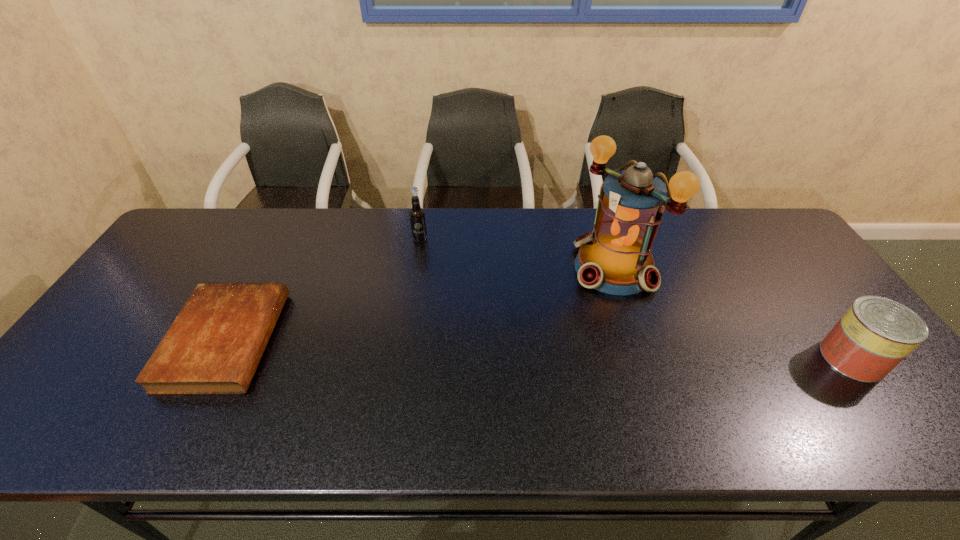
Find the location of a particular element. This screenshot has width=960, height=540. empty space that is in between the leftmost object and the tallest object is located at coordinates (420, 304).

The height and width of the screenshot is (540, 960). I want to click on unoccupied position between the tallest object and the can, so click(x=732, y=313).

What are the coordinates of `vacant area that lies between the root beer and the shortest object` in the screenshot? It's located at (323, 289).

Where is `free space between the leftmost object and the lantern`? free space between the leftmost object and the lantern is located at coordinates (420, 304).

Locate an element on the screen. The image size is (960, 540). vacant area that lies between the Bible and the third tallest object is located at coordinates (540, 349).

The image size is (960, 540). What are the coordinates of `free point between the rightmost object and the shortest object` in the screenshot? It's located at (540, 349).

The height and width of the screenshot is (540, 960). In order to click on vacant space that's between the leftmost object and the rightmost object in this screenshot , I will do `click(540, 349)`.

Identify which object is the nearest to the shortest object. Please provide its 2D coordinates. Your answer should be formatted as a tuple, i.e. [(x, y)], where the tuple contains the x and y coordinates of a point satisfying the conditions above.

[(417, 216)]

Choose which object is the third nearest neighbor to the tallest object. Please provide its 2D coordinates. Your answer should be formatted as a tuple, i.e. [(x, y)], where the tuple contains the x and y coordinates of a point satisfying the conditions above.

[(213, 347)]

You are a GUI agent. You are given a task and a screenshot of the screen. Output one action in this format:
    pyautogui.click(x=<x>, y=<y>)
    Task: Click on the vacant space that satisfies the following two spatial constraints: 1. on the front side of the root beer; 2. on the left side of the rightmost object
    
    Given the screenshot: What is the action you would take?
    pyautogui.click(x=401, y=359)